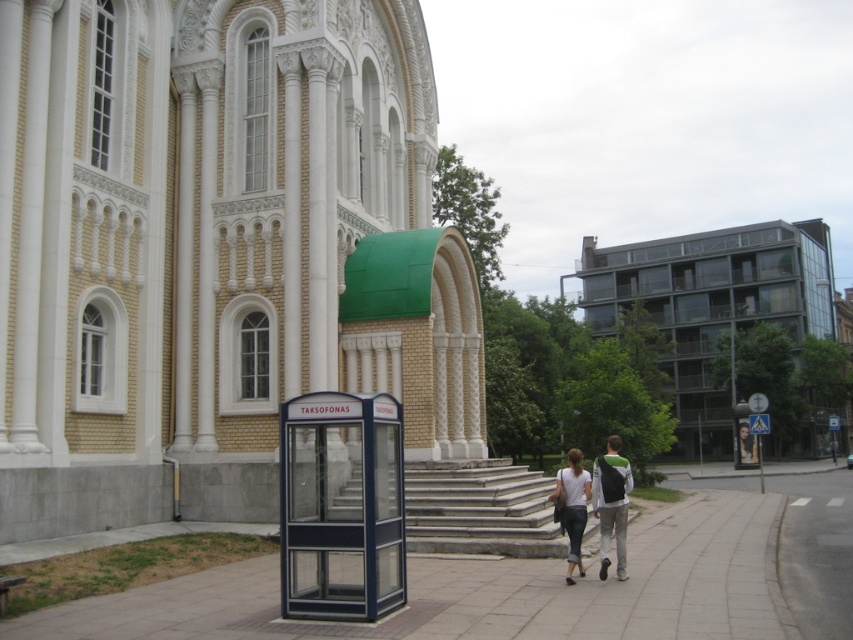
Question: Is metallic blue booth at center closer to camera compared to stone steps at center?

Choices:
 (A) yes
 (B) no

Answer: (A)

Question: Is metallic blue booth at center above dark gray backpack at center?

Choices:
 (A) yes
 (B) no

Answer: (A)

Question: Which point is farther to the camera?

Choices:
 (A) (582, 500)
 (B) (287, 248)

Answer: (B)

Question: Considering the real-world distances, which object is farthest from the stone steps at center?

Choices:
 (A) smooth concrete pavement at center
 (B) dark gray backpack at center
 (C) white cotton shirt at center
 (D) transparent glass building at right

Answer: (D)

Question: Among these points, which one is nearest to the camera?

Choices:
 (A) (579, 474)
 (B) (556, 493)
 (C) (599, 548)

Answer: (B)

Question: Does metallic blue booth at center appear on the left side of dark gray backpack at center?

Choices:
 (A) no
 (B) yes

Answer: (B)